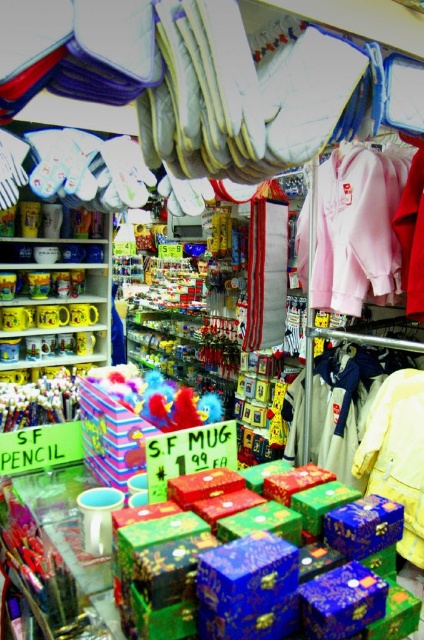
You are a customer in the store and want to place a large gift on the shiny metallic boxes at center without covering the matte plastic pencils at left. Which direction should you place the gift?

The shiny metallic boxes at center are wider than the matte plastic pencils at left, so placing the gift to the right of the shiny metallic boxes at center would avoid covering the matte plastic pencils at left.

You are a customer looking to buy a gift for a friend. You see the shiny metallic boxes at center and the matte plastic pencils at left. Which item is taller?

The shiny metallic boxes at center is taller than the matte plastic pencils at left.